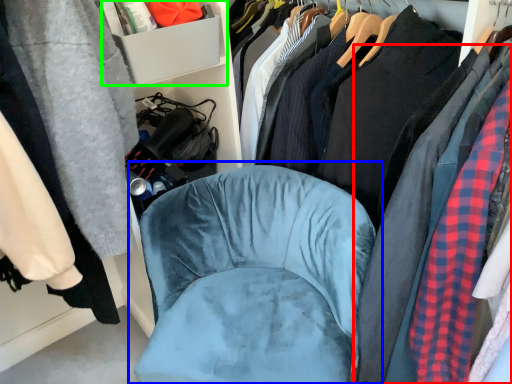
Question: Which is farther away from clothing (highlighted by a red box)? chair (highlighted by a blue box) or cabinet (highlighted by a green box)?

Choices:
 (A) chair
 (B) cabinet

Answer: (B)